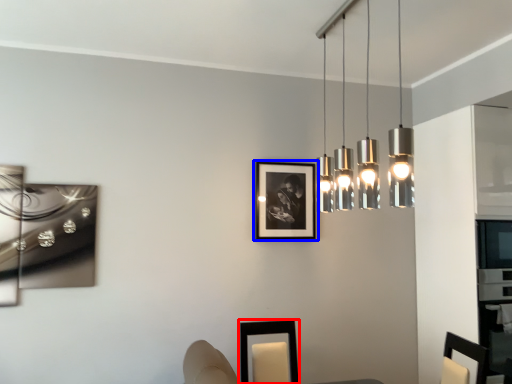
Question: Among these objects, which one is nearest to the camera, picture frame (highlighted by a red box) or picture frame (highlighted by a blue box)?

Choices:
 (A) picture frame
 (B) picture frame

Answer: (A)